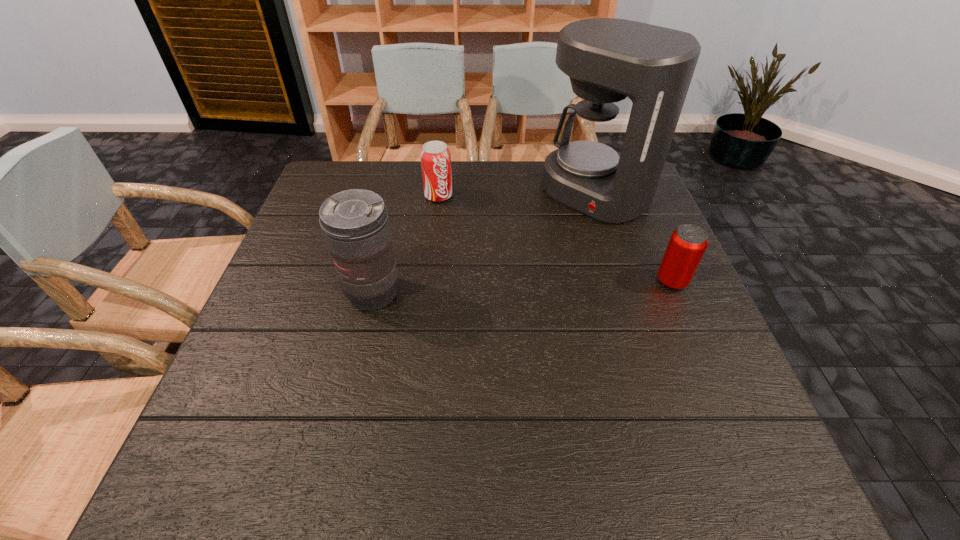
Identify the location of vacant space on the desktop that is between the leftmost object and the can and is positioned on the logo side of the third object from right to left. This screenshot has width=960, height=540. (500, 288).

What are the coordinates of `free spot on the desktop that is between the telephoto lens and the can and is positioned on the button side of the tallest object` in the screenshot? It's located at (481, 289).